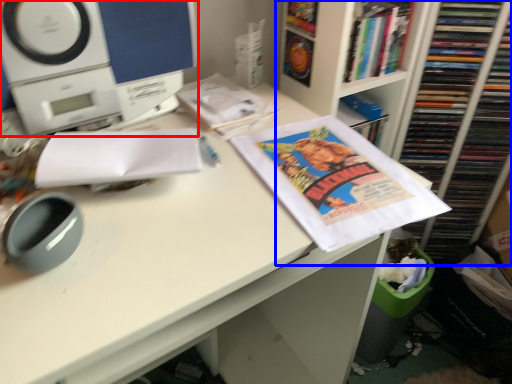
Question: Which object appears closest to the camera in this image, home appliance (highlighted by a red box) or bookcase (highlighted by a blue box)?

Choices:
 (A) home appliance
 (B) bookcase

Answer: (A)